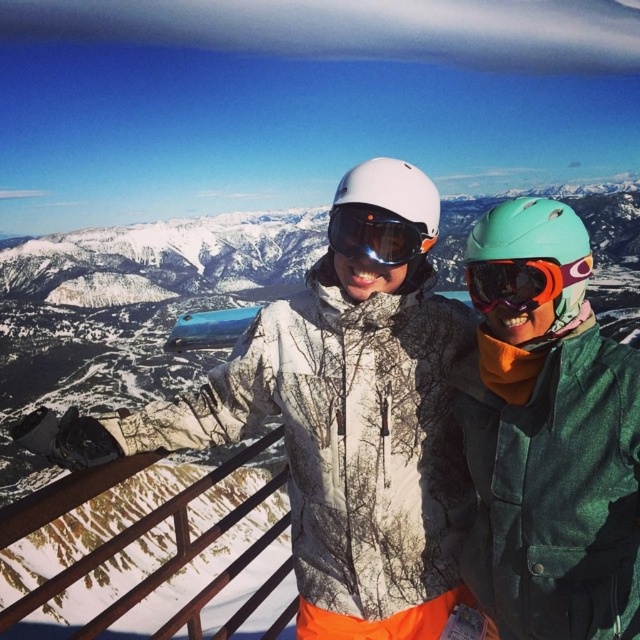
You are planning to take a photo of the two people on the ski lift. The camera you have can focus on objects up to 150 feet away. Given that the point between them is at point (x=454, y=541), will the camera be able to capture both individuals clearly in the same photo?

The two individuals are 154.84 feet apart. Since the camera can only focus on objects up to 150 feet away, the distance between them exceeds the camera focus range. Therefore, the camera may not be able to capture both individuals clearly in the same photo.

You are a photographer trying to capture a closeup shot of the matte green helmet at center and the matte orange goggles at center. Since you want to focus on the larger object, which one should you adjust your camera settings for?

The matte green helmet at center is bigger than the matte orange goggles at center, so you should adjust your camera settings to focus on the matte green helmet at center.